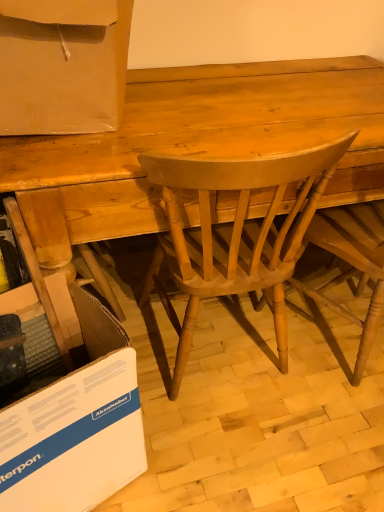
Locate an element on the screen. vacant space to the right of matte cardboard box at upper left is located at coordinates (229, 94).